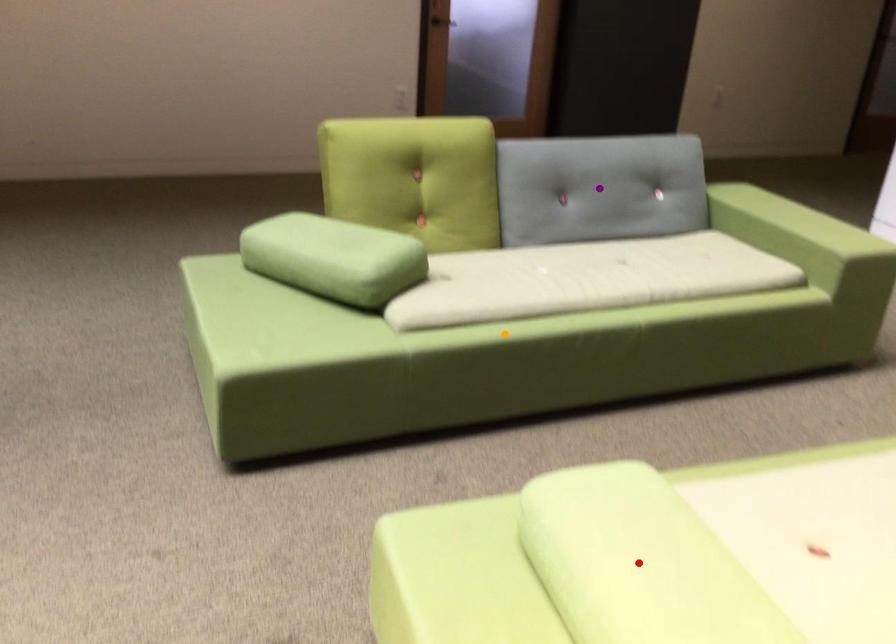
Order these from farthest to nearest:
A) orange point
B) purple point
C) red point

purple point < orange point < red point